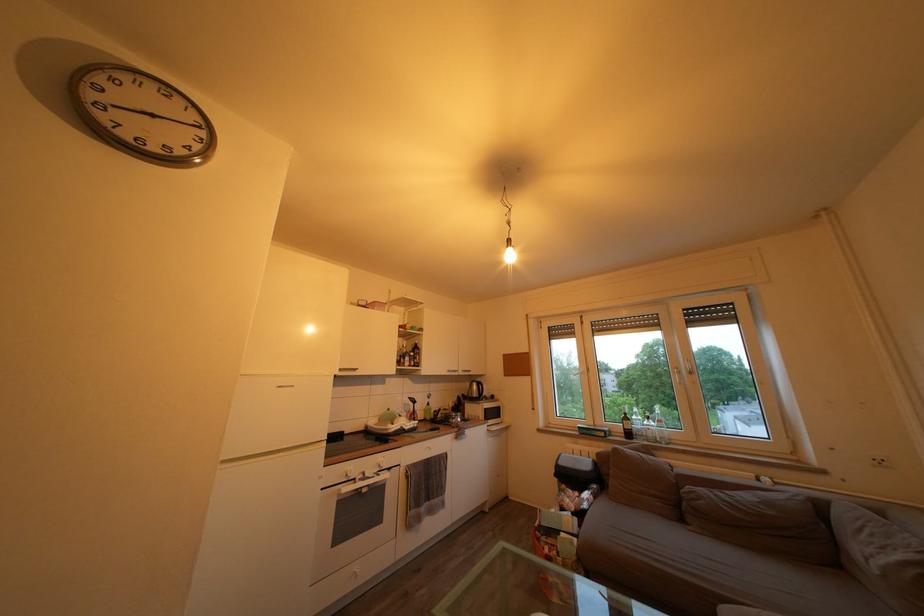
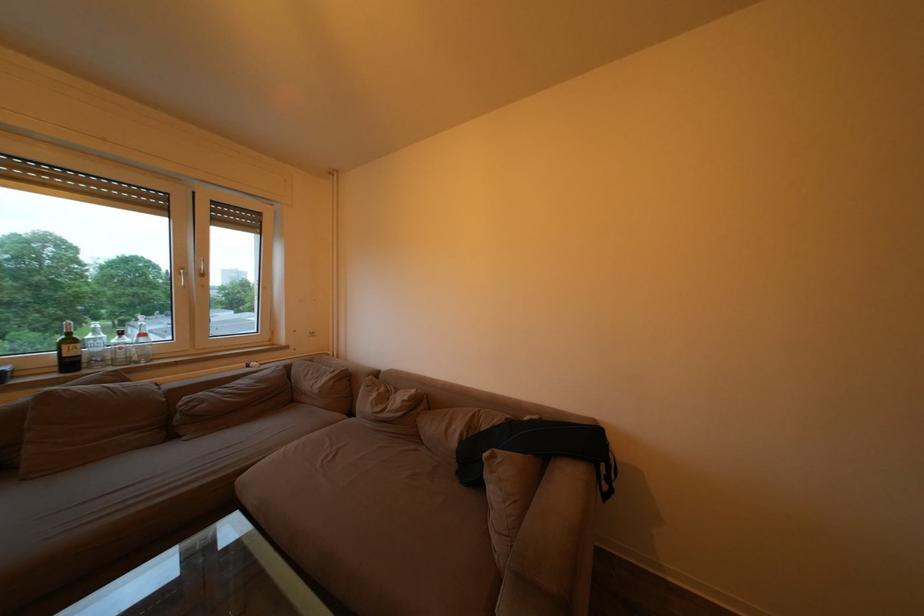
Locate, in the second image, the point that corresponds to point 647,432 in the first image.

(107, 355)